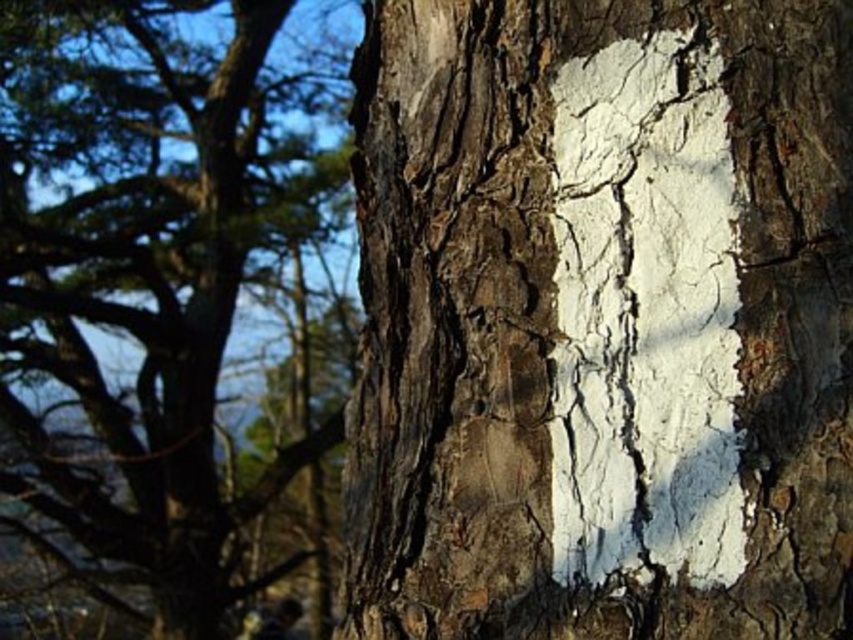
You are standing in front of a tree trunk with two marks labeled as point 1 at coordinates (660, 534) and point 2 at coordinates (62, 346). Which point is closer to you?

Point 1 at coordinates (660, 534) is closer to you because it is in front of point 2 at coordinates (62, 346).

You are a painter observing the tree trunk. You want to paint the white cracked bark at center and the cracked bark tree trunk at center. Which part should you paint first if you want to start with the lower section?

You should start with the white cracked bark at center because it is positioned under the cracked bark tree trunk at center, making it the lower section.